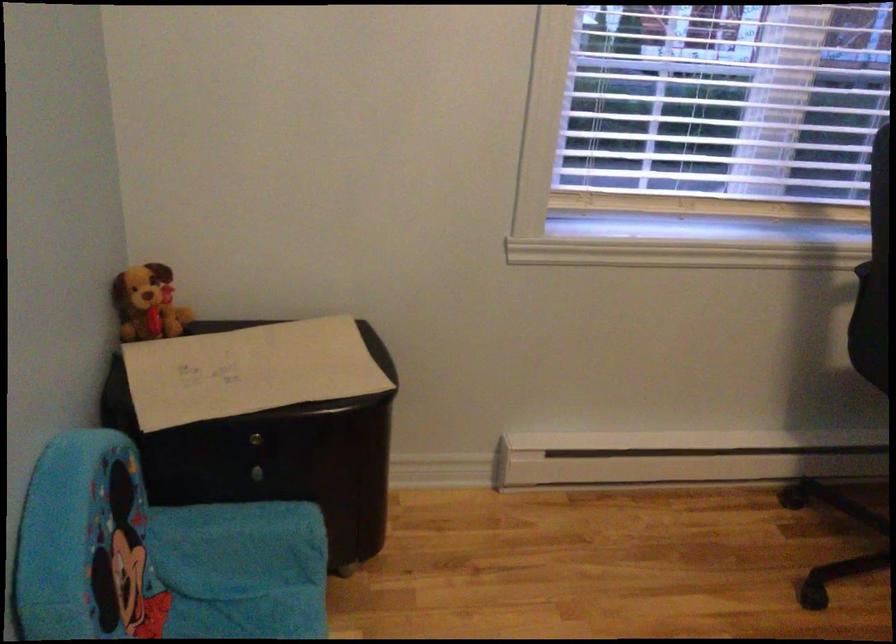
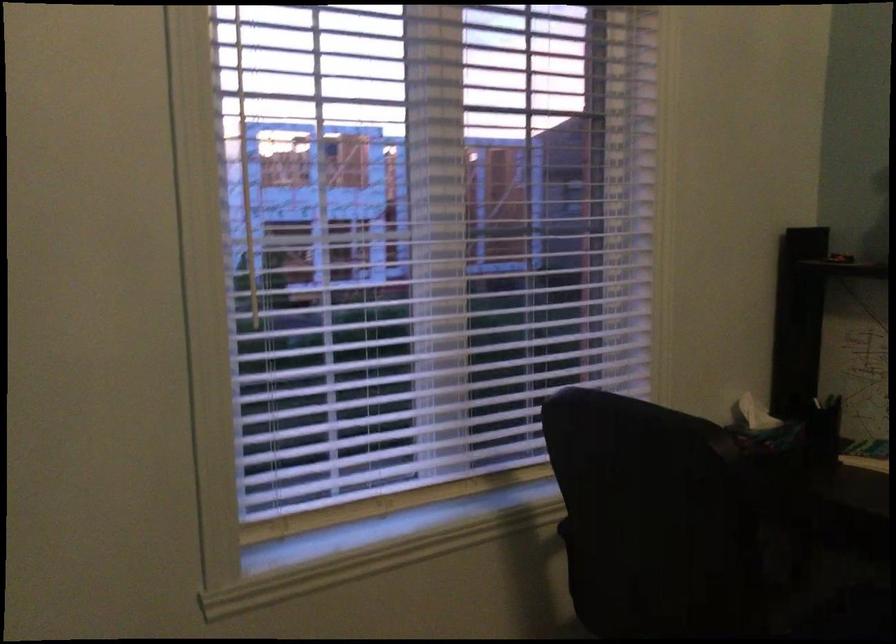
Question: The images are taken continuously from a first-person perspective. In which direction is your viewpoint rotating?

Choices:
 (A) Left
 (B) Right
 (C) Up
 (D) Down

Answer: (B)